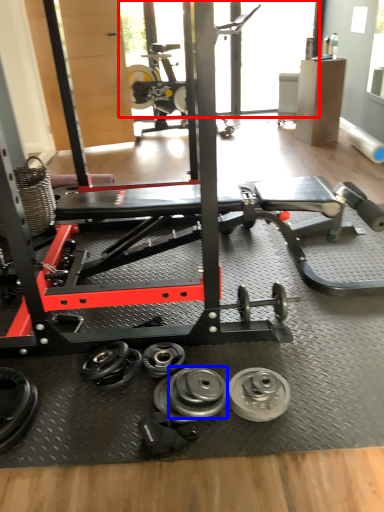
Question: Which of the following is the closest to the observer, window screen (highlighted by a red box) or dumbbell (highlighted by a blue box)?

Choices:
 (A) window screen
 (B) dumbbell

Answer: (B)